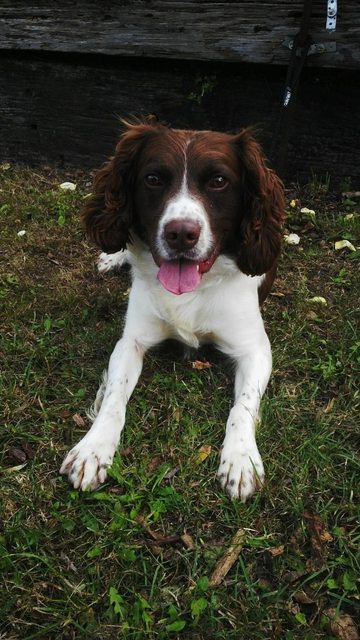
At what (x,y) coordinates should I click in order to perform the action: click on white fur. Please return your answer as a coordinate pair (x, y). Image resolution: width=360 pixels, height=640 pixels. Looking at the image, I should click on (185, 204), (222, 307), (115, 258), (204, 246), (162, 246), (115, 388), (246, 408), (260, 278), (187, 143).